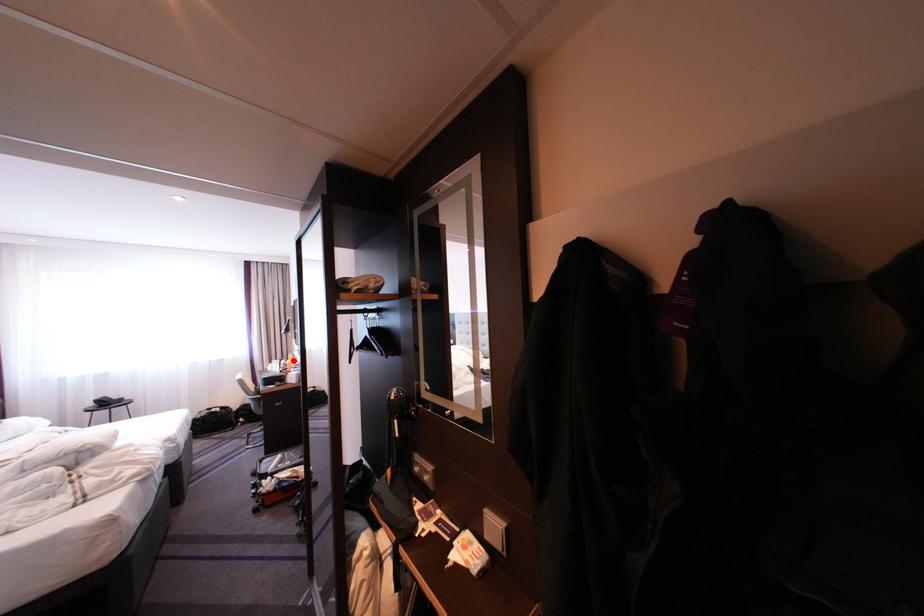
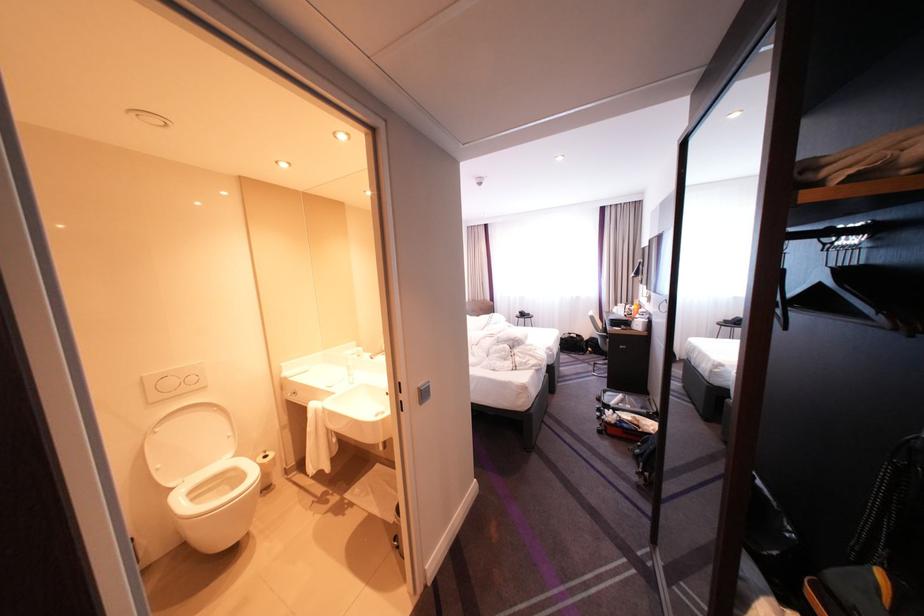
In the second image, find the point that corresponds to the highlighted location in the first image.

(638, 305)